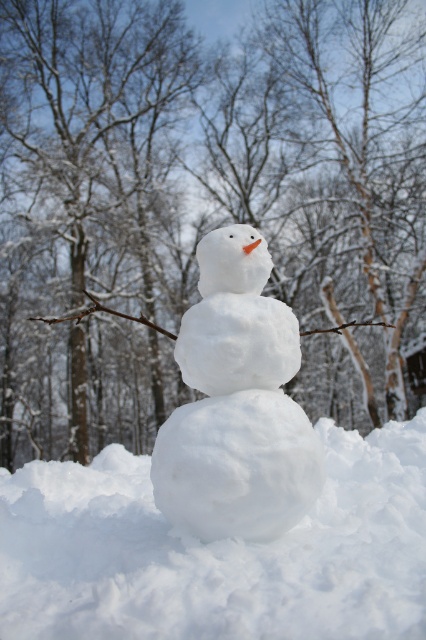
Between white fluffy snowball at center and white fluffy snowman at center, which one appears on the left side from the viewer's perspective?

From the viewer's perspective, white fluffy snowball at center appears more on the left side.

Is white fluffy snowball at center smaller than white fluffy snowman at center?

Incorrect, white fluffy snowball at center is not smaller in size than white fluffy snowman at center.

Does point (144, 584) come farther from viewer compared to point (311, 500)?

That is False.

At what (x,y) coordinates should I click in order to perform the action: click on white fluffy snowball at center. Please return your answer as a coordinate pair (x, y). The height and width of the screenshot is (640, 426). Looking at the image, I should click on (218, 552).

Looking at this image, between white snow at center and white fluffy snowman at center, which one is positioned higher?

white snow at center is higher up.

Between white snow at center and white fluffy snowman at center, which one is positioned lower?

white fluffy snowman at center

What do you see at coordinates (204, 204) in the screenshot? I see `white snow at center` at bounding box center [204, 204].

Locate an element on the screen. white snow at center is located at coordinates (204, 204).

Does white snow at center have a smaller size compared to white fluffy snowball at center?

No.

Is white snow at center positioned before white fluffy snowball at center?

That is False.

Find the location of a particular element. The width and height of the screenshot is (426, 640). white snow at center is located at coordinates (204, 204).